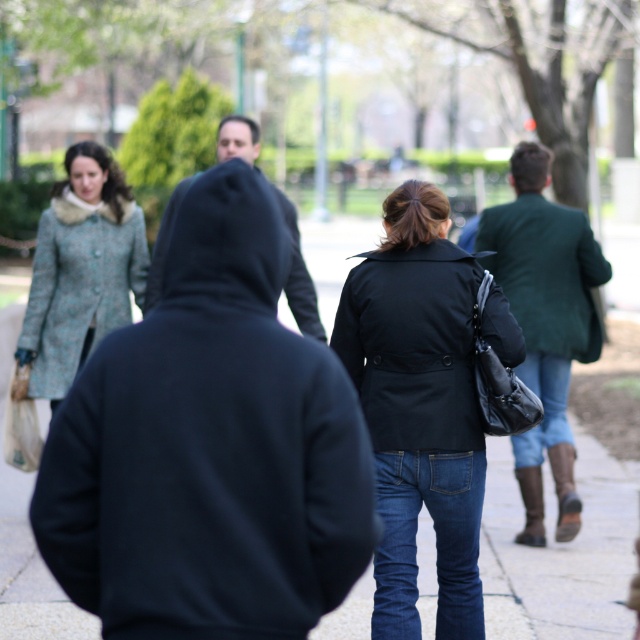
In the scene shown: You are standing at the camera position and want to find the matte black coat at center. According to the coordinates provided in the Objects Description, in which direction should you look to locate it?

The matte black coat at center is located at coordinates point (419, 406), which translates to the center area of the image. Therefore, you should look towards the center of the image to find it.

You are standing at the point with coordinates point (88, 324) and want to walk towards the point with coordinates point (454, 420). Which direction should you move relative to the other people in the scene?

You should move forward towards point (454, 420), which is in front of point (88, 324). The direction would be towards the midground where the three individuals are walking away from the viewer.